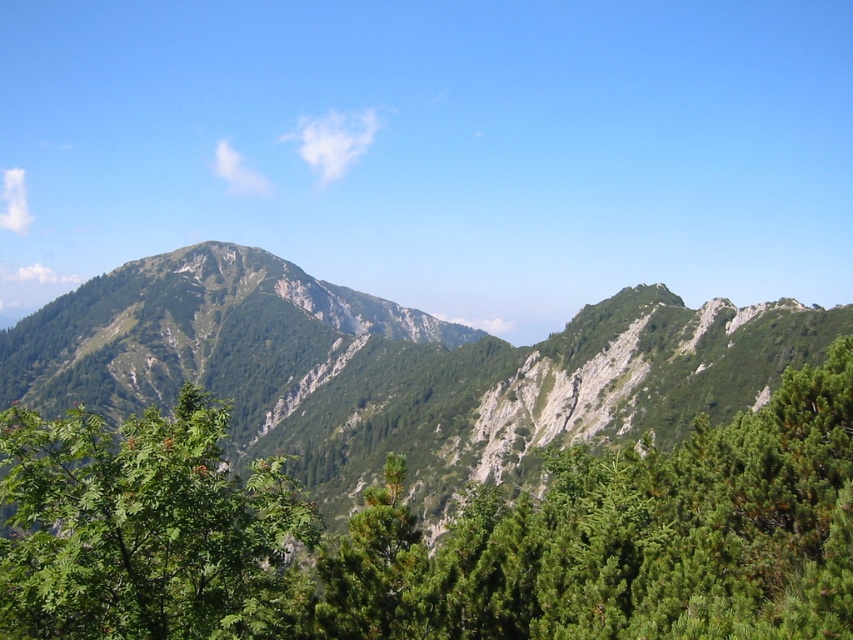
You are an explorer navigating through the mountainous landscape depicted in the image. You have two points marked on your map corresponding to coordinates point (320, 305) and point (296, 492). Which point is closer to the foreground of the scene?

Point (296, 492) is closer to the foreground because it is in front of point (320, 305), which is behind it.

From the picture: You are a hiker planning to take a photo of the green leafy tree at lower left and the green rocky mountain range at center. Which object should you focus on first if you want to capture both in a single frame without changing your camera settings?

The green leafy tree at lower left should be focused on first because it is closer to you than the green rocky mountain range at center, which is much taller and farther away.